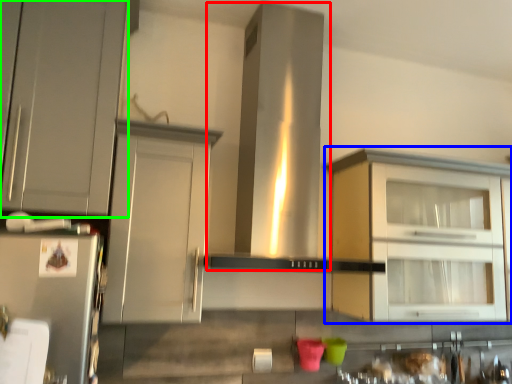
Question: Which object is positioned farthest from vent (highlighted by a red box)? Select from cabinetry (highlighted by a blue box) and cabinetry (highlighted by a green box).

Choices:
 (A) cabinetry
 (B) cabinetry

Answer: (B)